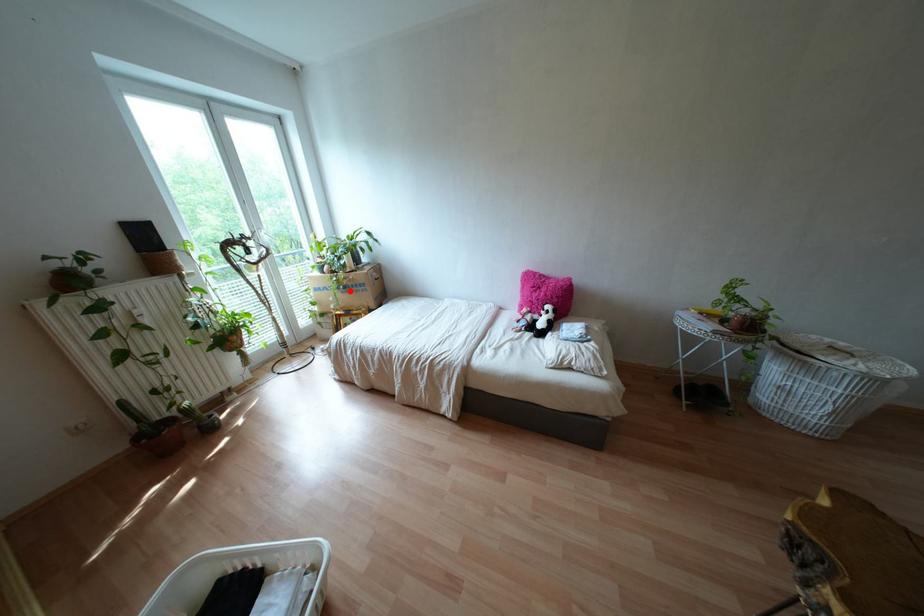
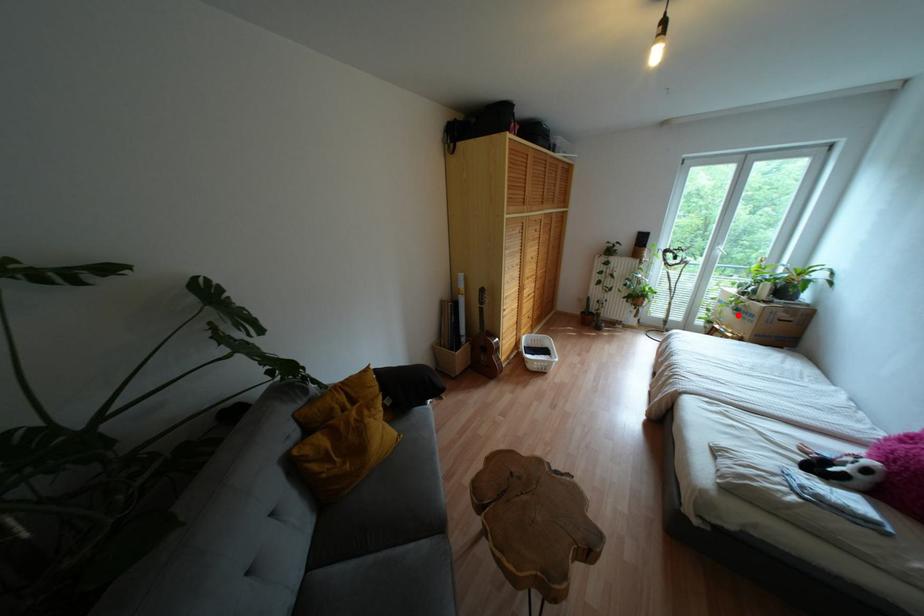
I am providing you with two images of the same scene from different viewpoints. A red point is marked on the first image and another point is marked on the second image. Is the marked point in image1 the same physical position as the marked point in image2?

Yes